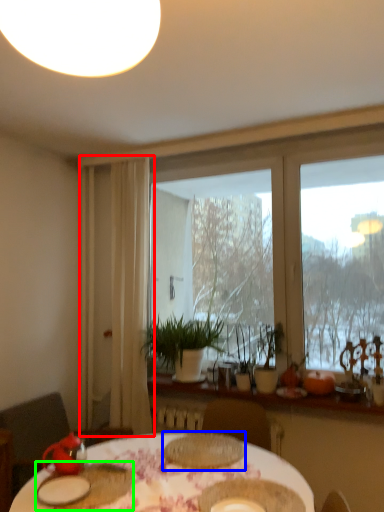
Question: Estimate the real-world distances between objects in this image. Which object is farther from curtain (highlighted by a red box), tableware (highlighted by a blue box) or tableware (highlighted by a green box)?

Choices:
 (A) tableware
 (B) tableware

Answer: (B)